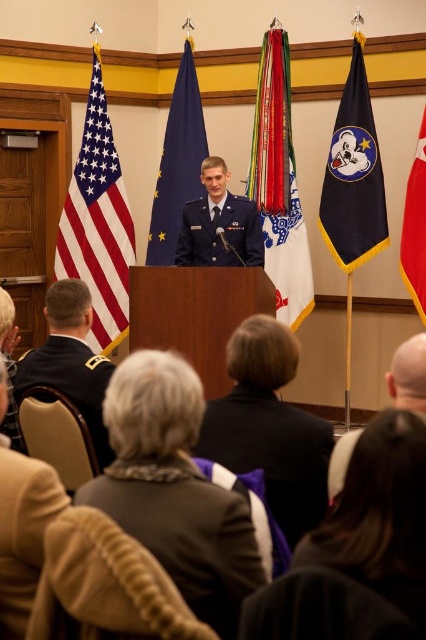
Question: Among these points, which one is nearest to the camera?

Choices:
 (A) (370, 106)
 (B) (98, 77)
 (C) (219, 252)
 (D) (394, 365)

Answer: (D)

Question: Based on their relative distances, which object is farther from the light brown fabric jacket at lower left?

Choices:
 (A) red fabric flag at right
 (B) dark gray wool jacket at lower center
 (C) navy blue fabric flag with gold trim at center
 (D) blue fabric flag at center

Answer: (C)

Question: Considering the real-world distances, which object is farthest from the dark gray wool jacket at lower center?

Choices:
 (A) dark blue fabric uniform at center
 (B) light brown fabric jacket at lower left

Answer: (A)

Question: Does dark gray wool jacket at lower center have a lesser width compared to bald head at center?

Choices:
 (A) no
 (B) yes

Answer: (A)

Question: Does bald head at center have a lesser width compared to red fabric flag at right?

Choices:
 (A) no
 (B) yes

Answer: (A)

Question: Can you confirm if dark gray wool jacket at lower center is bigger than red fabric flag at right?

Choices:
 (A) no
 (B) yes

Answer: (A)